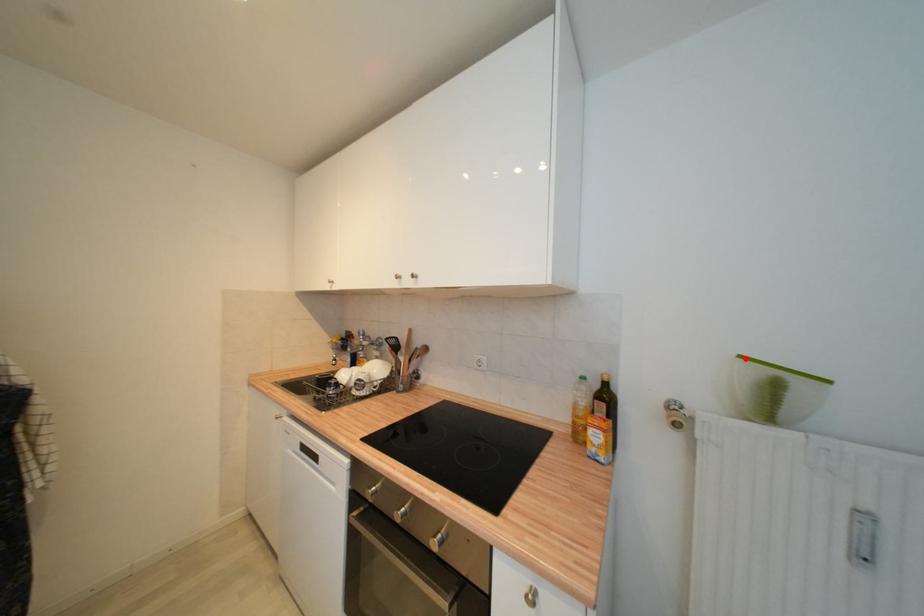
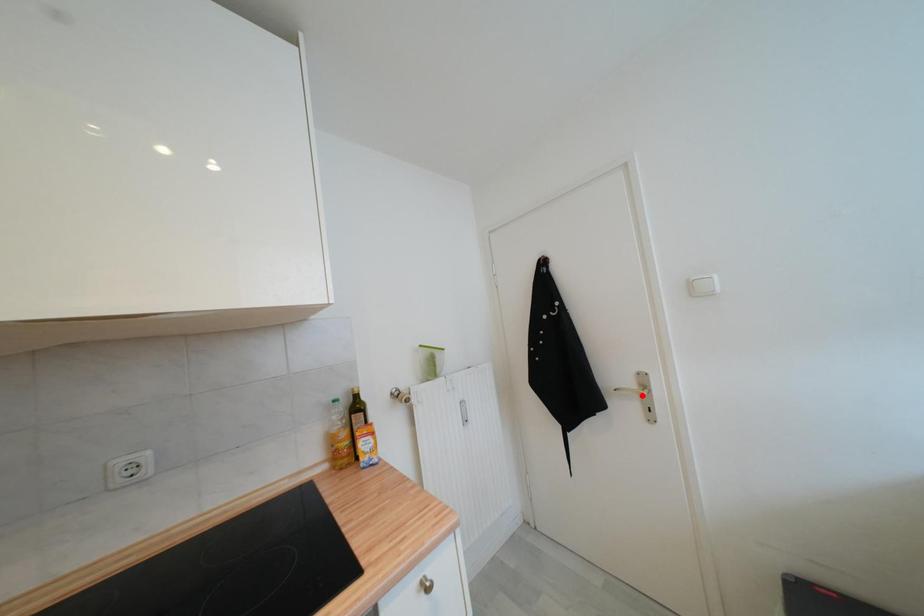
I am providing you with two images of the same scene from different viewpoints. A red point is marked on the first image and another point is marked on the second image. Is the marked point in image1 the same physical position as the marked point in image2?

No